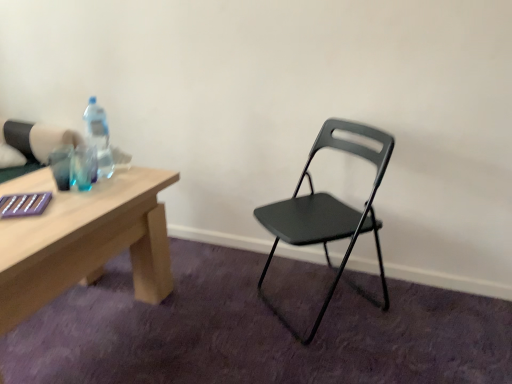
Where is `empty space that is to the right of matte black folding chair at center`? empty space that is to the right of matte black folding chair at center is located at coordinates (415, 313).